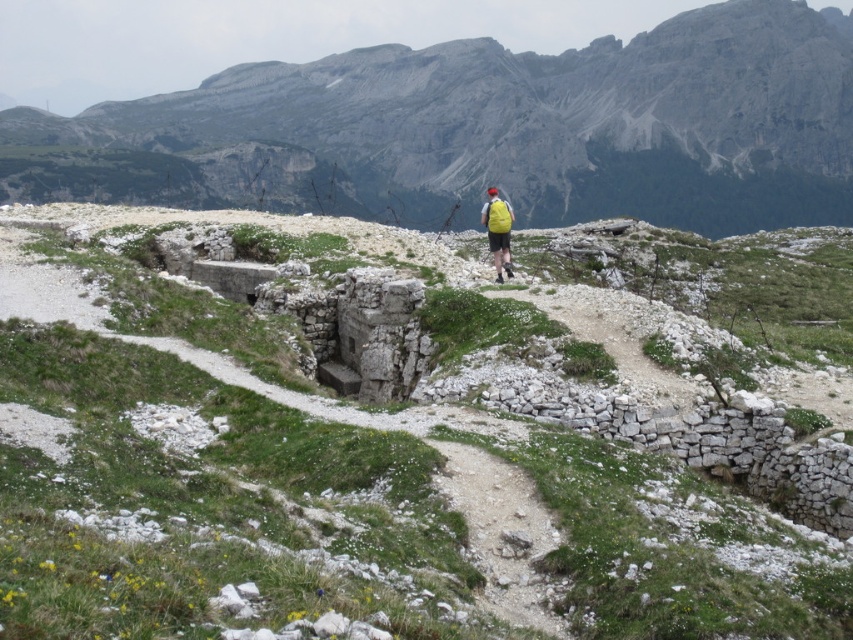
Question: Is white stone path at center to the left of gray rocky mountain at upper center from the viewer's perspective?

Choices:
 (A) no
 (B) yes

Answer: (A)

Question: Can you confirm if gray rocky mountain at upper center is wider than yellow fabric backpack at center?

Choices:
 (A) no
 (B) yes

Answer: (B)

Question: Based on their relative distances, which object is farther from the white stone path at center?

Choices:
 (A) gray rocky mountain at upper center
 (B) yellow fabric backpack at center

Answer: (A)

Question: Which point is closer to the camera?

Choices:
 (A) yellow fabric backpack at center
 (B) white stone path at center

Answer: (B)

Question: Which object is positioned closest to the gray rocky mountain at upper center?

Choices:
 (A) white stone path at center
 (B) yellow fabric backpack at center

Answer: (B)

Question: Does white stone path at center have a lesser width compared to yellow fabric backpack at center?

Choices:
 (A) yes
 (B) no

Answer: (B)